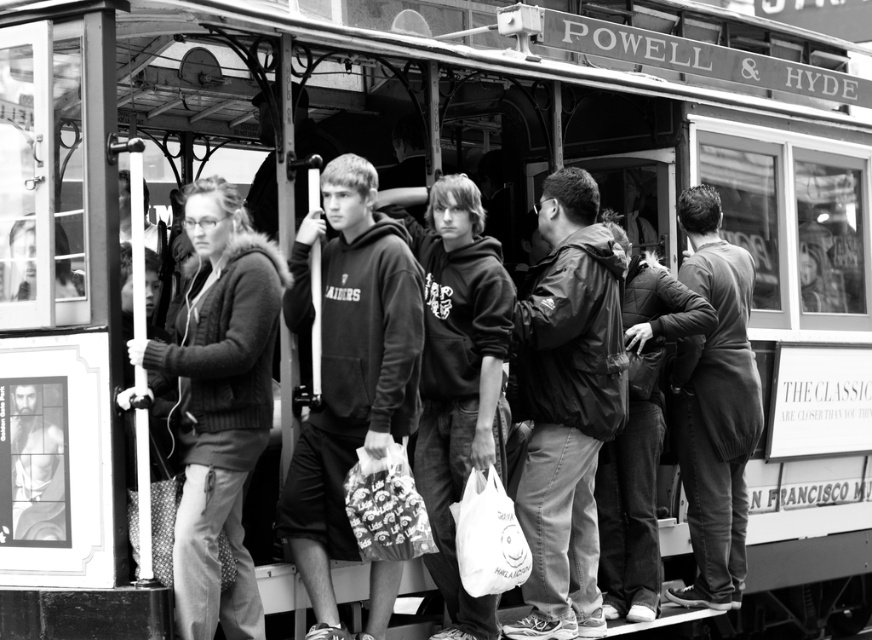
Question: From the image, what is the correct spatial relationship of dark gray hoodie at center in relation to knitted sweater at center?

Choices:
 (A) below
 (B) above

Answer: (B)

Question: Is dark gray sweater at center closer to the viewer compared to dark gray quilted jacket at center?

Choices:
 (A) yes
 (B) no

Answer: (B)

Question: Which object appears farthest from the camera in this image?

Choices:
 (A) knitted sweater at center
 (B) dark gray quilted jacket at center
 (C) dark gray sweater at center
 (D) bearded man at lower left

Answer: (C)

Question: Does matte black hoodie at center have a larger size compared to dark gray sweater at center?

Choices:
 (A) yes
 (B) no

Answer: (A)

Question: Which point appears farthest from the camera in this image?

Choices:
 (A) (682, 445)
 (B) (566, 474)
 (C) (628, 580)

Answer: (A)

Question: Which object is farther from the camera taking this photo?

Choices:
 (A) matte black hoodie at center
 (B) matte black jacket at center

Answer: (B)